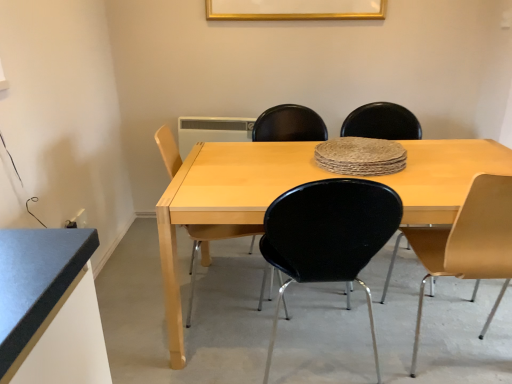
Find the location of a particular element. gold metallic picture frame at upper center is located at coordinates (295, 9).

Identify the location of white plastic radiator at upper center. (212, 131).

What is the approximate height of light wood/black plastic chair at center, the 1th chair when ordered from left to right?

34.07 inches.

What do you see at coordinates (328, 235) in the screenshot?
I see `glossy black chair at center, placed as the third chair when sorted from right to left` at bounding box center [328, 235].

Locate an element on the screen. Image resolution: width=512 pixels, height=384 pixels. gold metallic picture frame at upper center is located at coordinates (295, 9).

Who is shorter, glossy black chair at center, placed as the third chair when sorted from right to left, or matte yellow chair at right, placed as the first chair when sorted from right to left?

Standing shorter between the two is glossy black chair at center, placed as the third chair when sorted from right to left.

Could matte yellow chair at right, which appears as the 4th chair when viewed from the left, be considered to be inside glossy black chair at center, placed as the third chair when sorted from right to left?

No, matte yellow chair at right, which appears as the 4th chair when viewed from the left, is not inside glossy black chair at center, placed as the third chair when sorted from right to left.

From the image's perspective, is glossy black chair at center, which is the 2th chair from left to right, above or below matte yellow chair at right, placed as the first chair when sorted from right to left?

Clearly, from the image's perspective, glossy black chair at center, which is the 2th chair from left to right, is below matte yellow chair at right, placed as the first chair when sorted from right to left.

In the scene shown: Which object is thinner, gold metallic picture frame at upper center or white plastic radiator at upper center?

Thinner between the two is gold metallic picture frame at upper center.

Do you think gold metallic picture frame at upper center is within white plastic radiator at upper center, or outside of it?

gold metallic picture frame at upper center is located beyond the bounds of white plastic radiator at upper center.

The height and width of the screenshot is (384, 512). Identify the location of picture frame above the white plastic radiator at upper center (from the image's perspective). (295, 9).

Considering the positions of points (297, 12) and (222, 135), is point (297, 12) closer to camera compared to point (222, 135)?

That is True.

Does light wood/black plastic chair at center, the 1th chair when ordered from left to right, have a smaller size compared to white plastic radiator at upper center?

No, light wood/black plastic chair at center, the 1th chair when ordered from left to right, is not smaller than white plastic radiator at upper center.

From the image's perspective, is light wood/black plastic chair at center, which is the 4th chair from right to left, on top of white plastic radiator at upper center?

No, from the image's perspective, light wood/black plastic chair at center, which is the 4th chair from right to left, is not on top of white plastic radiator at upper center.

Considering the sizes of objects light wood/black plastic chair at center, which is the 4th chair from right to left, and white plastic radiator at upper center in the image provided, who is wider, light wood/black plastic chair at center, which is the 4th chair from right to left, or white plastic radiator at upper center?

With larger width is light wood/black plastic chair at center, which is the 4th chair from right to left.

Where is `appliance located on the left of light wood/black plastic chair at center, which is the 4th chair from right to left`? appliance located on the left of light wood/black plastic chair at center, which is the 4th chair from right to left is located at coordinates (212, 131).

How many degrees apart are the facing directions of matte black chair at center, placed as the second chair when sorted from right to left, and white plastic radiator at upper center?

2.64 degrees separate the facing orientations of matte black chair at center, placed as the second chair when sorted from right to left, and white plastic radiator at upper center.

Considering the relative sizes of matte black chair at center, which is counted as the 3th chair, starting from the left, and white plastic radiator at upper center in the image provided, is matte black chair at center, which is counted as the 3th chair, starting from the left, bigger than white plastic radiator at upper center?

Yes.

Is point (374, 133) closer or farther from the camera than point (202, 120)?

Point (374, 133).

From the image's perspective, between matte black chair at center, placed as the second chair when sorted from right to left, and white plastic radiator at upper center, which one is located above?

From the image's view, white plastic radiator at upper center is above.

From the image's perspective, between light wood/black plastic chair at center, which is the 4th chair from right to left, and glossy black chair at center, placed as the third chair when sorted from right to left, which one is located above?

light wood/black plastic chair at center, which is the 4th chair from right to left, appears higher in the image.

Is point (192, 266) positioned behind point (310, 250)?

That is True.

From a real-world perspective, is light wood/black plastic chair at center, the 1th chair when ordered from left to right, on glossy black chair at center, which is the 2th chair from left to right?

No, from a real-world perspective, light wood/black plastic chair at center, the 1th chair when ordered from left to right, is not over glossy black chair at center, which is the 2th chair from left to right

Which of these two, light wood/black plastic chair at center, which is the 4th chair from right to left, or glossy black chair at center, which is the 2th chair from left to right, stands shorter?

glossy black chair at center, which is the 2th chair from left to right, is shorter.

Is light wood table at center closer to camera compared to light wood/black plastic chair at center, the 1th chair when ordered from left to right?

Yes, light wood table at center is in front of light wood/black plastic chair at center, the 1th chair when ordered from left to right.

From a real-world perspective, is light wood table at center over light wood/black plastic chair at center, the 1th chair when ordered from left to right?

Actually, light wood table at center is physically below light wood/black plastic chair at center, the 1th chair when ordered from left to right, in the real world.

Is light wood table at center at the left side of light wood/black plastic chair at center, which is the 4th chair from right to left?

No.

Which is in front, point (185, 358) or point (172, 155)?

Positioned in front is point (185, 358).

In the scene shown: Can you see gold metallic picture frame at upper center touching matte yellow chair at right, placed as the first chair when sorted from right to left?

gold metallic picture frame at upper center and matte yellow chair at right, placed as the first chair when sorted from right to left, are not in contact.

From a real-world perspective, is gold metallic picture frame at upper center over matte yellow chair at right, which appears as the 4th chair when viewed from the left?

Correct, in the physical world, gold metallic picture frame at upper center is higher than matte yellow chair at right, which appears as the 4th chair when viewed from the left.

Considering the positions of objects gold metallic picture frame at upper center and matte yellow chair at right, which appears as the 4th chair when viewed from the left, in the image provided, who is in front, gold metallic picture frame at upper center or matte yellow chair at right, which appears as the 4th chair when viewed from the left,?

matte yellow chair at right, which appears as the 4th chair when viewed from the left, is in front.

From a real-world perspective, count 2nd chairs downward from the glossy black chair at center, placed as the third chair when sorted from right to left, and point to it. Please provide its 2D coordinates.

[(466, 244)]

You are a GUI agent. You are given a task and a screenshot of the screen. Output one action in this format:
    pyautogui.click(x=<x>, y=<y>)
    Task: Click on the appliance behind the gold metallic picture frame at upper center
    This screenshot has width=512, height=384.
    Given the screenshot: What is the action you would take?
    pyautogui.click(x=212, y=131)

When comparing their distances from matte black chair at center, placed as the second chair when sorted from right to left, does light wood table at center or gold metallic picture frame at upper center seem further?

The object further to matte black chair at center, placed as the second chair when sorted from right to left, is gold metallic picture frame at upper center.

Estimate the real-world distances between objects in this image. Which object is closer to light wood/black plastic chair at center, which is the 4th chair from right to left, white plastic radiator at upper center or matte yellow chair at right, which appears as the 4th chair when viewed from the left?

Among the two, matte yellow chair at right, which appears as the 4th chair when viewed from the left, is located nearer to light wood/black plastic chair at center, which is the 4th chair from right to left.

When comparing their distances from white plastic radiator at upper center, does light wood table at center or matte yellow chair at right, which appears as the 4th chair when viewed from the left, seem closer?

light wood table at center is closer to white plastic radiator at upper center.

Looking at the image, which one is located further to light wood table at center, matte yellow chair at right, placed as the first chair when sorted from right to left, or glossy black chair at center, which is the 2th chair from left to right?

matte yellow chair at right, placed as the first chair when sorted from right to left, is further to light wood table at center.

From the image, which object appears to be farther from gold metallic picture frame at upper center, matte black chair at center, which is counted as the 3th chair, starting from the left, or matte yellow chair at right, which appears as the 4th chair when viewed from the left?

matte yellow chair at right, which appears as the 4th chair when viewed from the left, lies further to gold metallic picture frame at upper center than the other object.

Looking at the image, which one is located closer to light wood table at center, glossy black chair at center, which is the 2th chair from left to right, or gold metallic picture frame at upper center?

Among the two, glossy black chair at center, which is the 2th chair from left to right, is located nearer to light wood table at center.

From the image, which object appears to be nearer to gold metallic picture frame at upper center, matte black chair at center, placed as the second chair when sorted from right to left, or glossy black chair at center, placed as the third chair when sorted from right to left?

Among the two, matte black chair at center, placed as the second chair when sorted from right to left, is located nearer to gold metallic picture frame at upper center.

When comparing their distances from light wood/black plastic chair at center, which is the 4th chair from right to left, does matte black chair at center, placed as the second chair when sorted from right to left, or matte yellow chair at right, which appears as the 4th chair when viewed from the left, seem closer?

Among the two, matte yellow chair at right, which appears as the 4th chair when viewed from the left, is located nearer to light wood/black plastic chair at center, which is the 4th chair from right to left.

At what (x,y) coordinates should I click in order to perform the action: click on table between light wood/black plastic chair at center, the 1th chair when ordered from left to right, and matte yellow chair at right, placed as the first chair when sorted from right to left. Please return your answer as a coordinate pair (x, y). Looking at the image, I should click on [223, 202].

At what (x,y) coordinates should I click in order to perform the action: click on table between gold metallic picture frame at upper center and glossy black chair at center, placed as the third chair when sorted from right to left, from top to bottom. Please return your answer as a coordinate pair (x, y). Looking at the image, I should click on (223, 202).

Locate an element on the screen. The image size is (512, 384). chair located between light wood/black plastic chair at center, the 1th chair when ordered from left to right, and light wood table at center in the left-right direction is located at coordinates (328, 235).

Find the location of a particular element. chair situated between light wood/black plastic chair at center, the 1th chair when ordered from left to right, and matte black chair at center, which is counted as the 3th chair, starting from the left, from left to right is located at coordinates (328, 235).